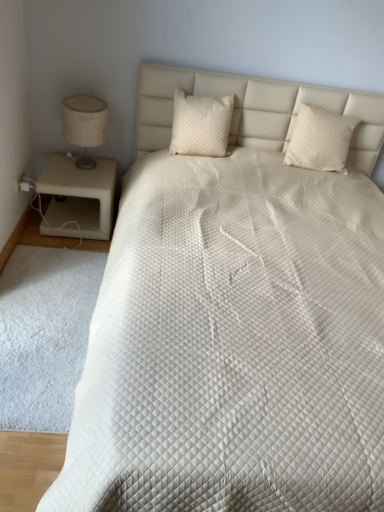
Identify the location of blank space above beige matte nightstand at left (from a real-world perspective). This screenshot has width=384, height=512. (87, 160).